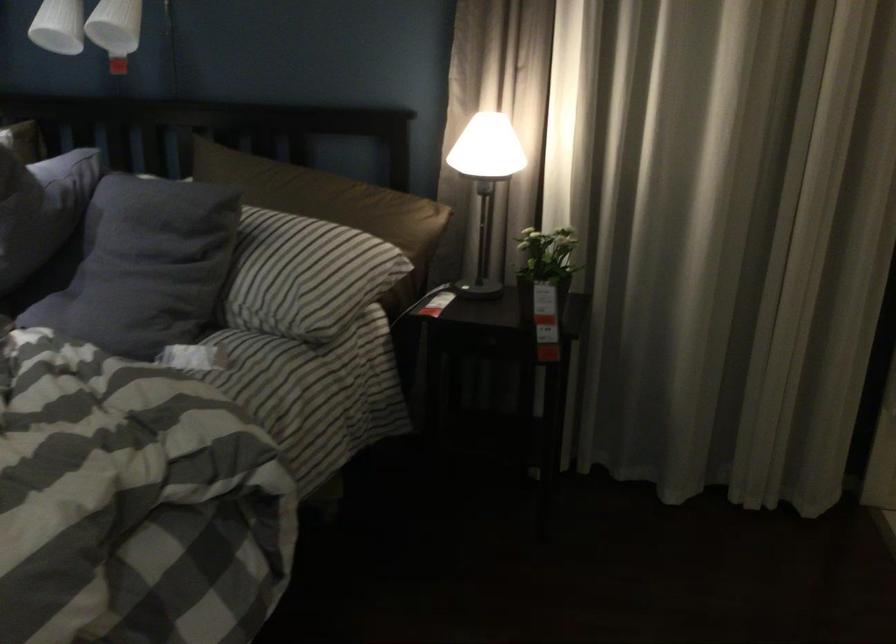
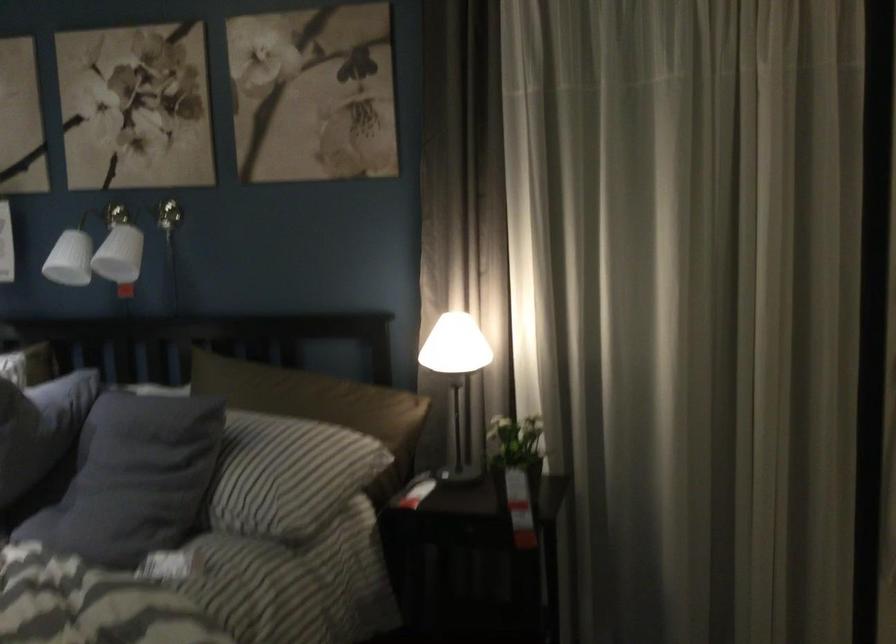
Locate, in the second image, the point that corresponds to the point at 487,147 in the first image.

(455, 345)